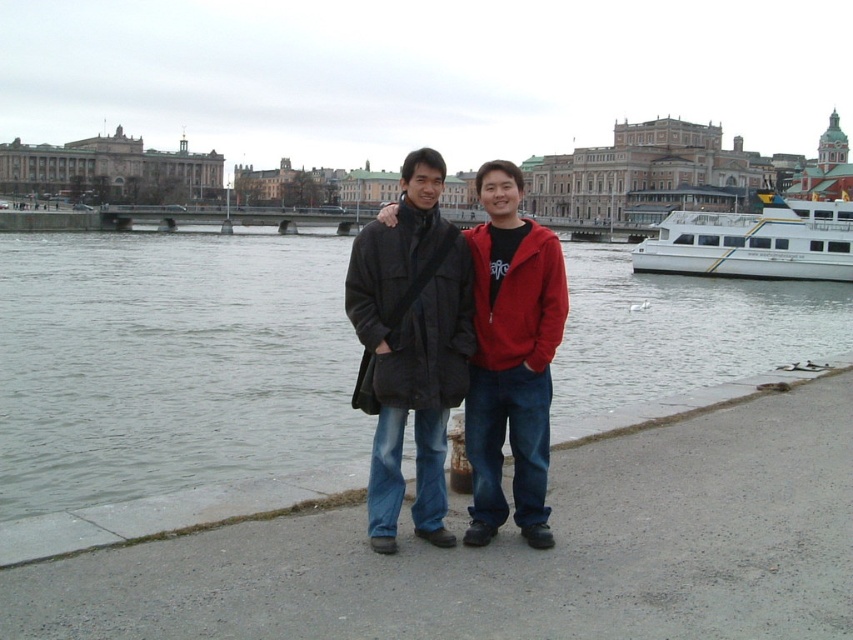
Question: Among these points, which one is nearest to the camera?

Choices:
 (A) (547, 259)
 (B) (762, 477)
 (C) (529, 326)

Answer: (C)

Question: Is gray concrete pavement at lower center to the left of matte red jacket at center from the viewer's perspective?

Choices:
 (A) no
 (B) yes

Answer: (A)

Question: In this image, where is matte black coat at center located relative to white glossy boat at right?

Choices:
 (A) left
 (B) right

Answer: (A)

Question: Which point is closer to the camera?

Choices:
 (A) matte red jacket at center
 (B) gray concrete pavement at lower center
 (C) white glossy boat at right
 (D) matte black coat at center

Answer: (B)

Question: Can you confirm if gray water at lower left is thinner than matte red jacket at center?

Choices:
 (A) no
 (B) yes

Answer: (A)

Question: Which of the following is the closest to the observer?

Choices:
 (A) gray water at lower left
 (B) white glossy boat at right

Answer: (A)